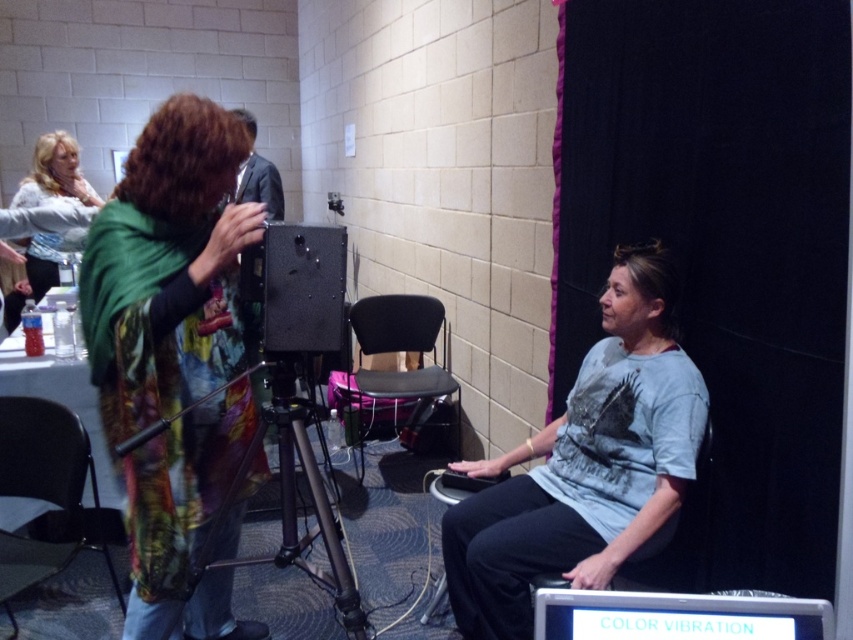
You are standing in the conference room and want to place a new monitor on the desk. The monitor requires at least 10 cm of vertical space. Can the white plastic computer at lower center accommodate the monitor based on its height compared to the light blue fabric shirt at upper left?

The white plastic computer at lower center is not as tall as the light blue fabric shirt at upper left. Since the monitor requires at least 10 cm of vertical space, but the exact height of the computer isn

You are setting up a presentation in the conference room. You need to place the white plastic computer at lower center and the metallic tripod at center such that the computer is to the right of the tripod. Is the current arrangement correct?

Yes, the current arrangement is correct because the white plastic computer at lower center is positioned on the right side of metallic tripod at center, which matches your requirement.